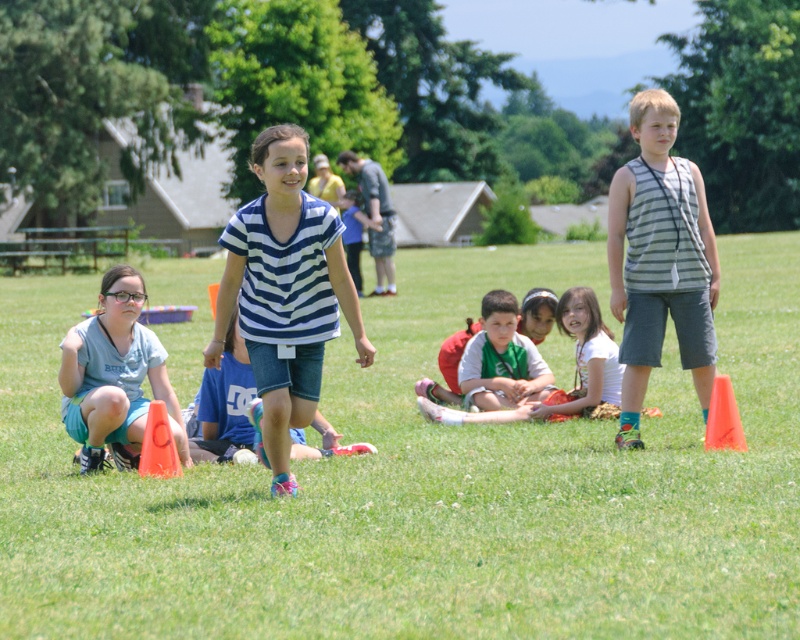
Question: Does green grassy field at center have a greater width compared to light blue denim shorts at lower left?

Choices:
 (A) yes
 (B) no

Answer: (A)

Question: Considering the real-world distances, which object is closest to the orange plastic cone at lower left?

Choices:
 (A) green grassy field at center
 (B) orange plastic cone at lower right
 (C) white cotton shirt at center
 (D) striped fabric tank top at right

Answer: (D)

Question: Is striped fabric shirt at center positioned behind orange plastic cone at lower left?

Choices:
 (A) no
 (B) yes

Answer: (A)

Question: Which point is closer to the camera taking this photo?

Choices:
 (A) (140, 276)
 (B) (590, 328)
 (C) (737, 417)

Answer: (C)

Question: Does striped fabric tank top at right have a greater width compared to orange plastic cone at lower left?

Choices:
 (A) no
 (B) yes

Answer: (B)

Question: Among these points, which one is farthest from the camera?

Choices:
 (A) (229, 225)
 (B) (141, 464)
 (C) (120, 364)
 (D) (622, 225)

Answer: (D)